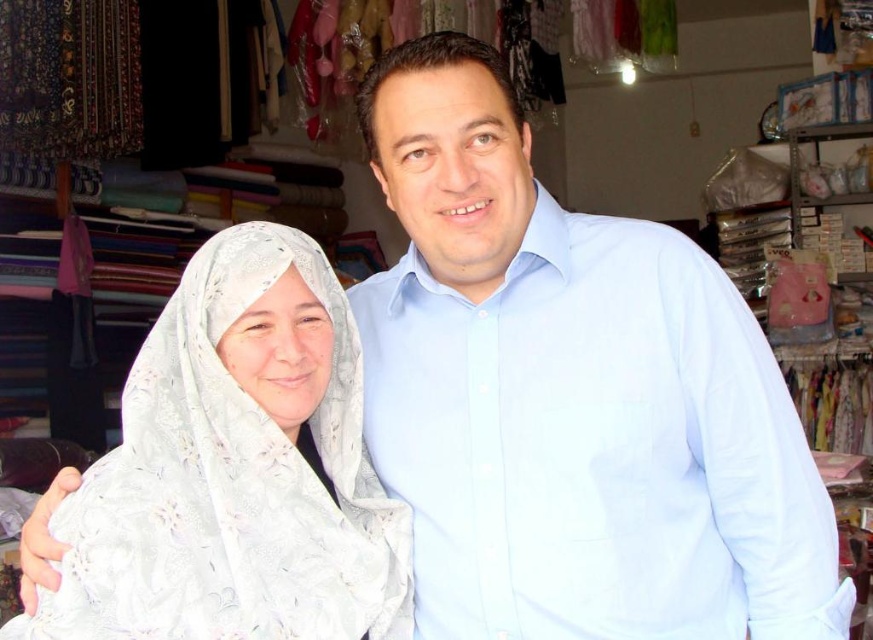
Question: Which point is farther from the camera taking this photo?

Choices:
 (A) (385, 582)
 (B) (712, 420)

Answer: (A)

Question: Can you confirm if light blue cotton shirt at center is wider than white lace headscarf at left?

Choices:
 (A) no
 (B) yes

Answer: (B)

Question: Among these objects, which one is nearest to the camera?

Choices:
 (A) light blue cotton shirt at center
 (B) white lace headscarf at left

Answer: (B)

Question: Does light blue cotton shirt at center appear on the left side of white lace headscarf at left?

Choices:
 (A) no
 (B) yes

Answer: (A)

Question: Is light blue cotton shirt at center to the left of white lace headscarf at left from the viewer's perspective?

Choices:
 (A) yes
 (B) no

Answer: (B)